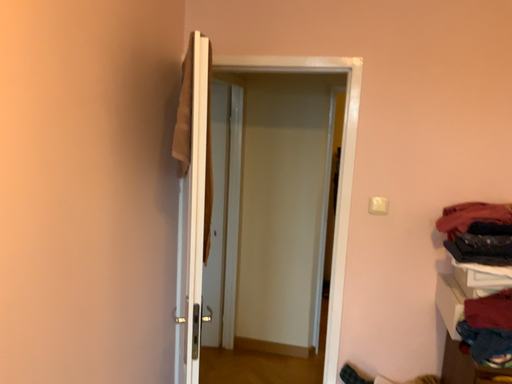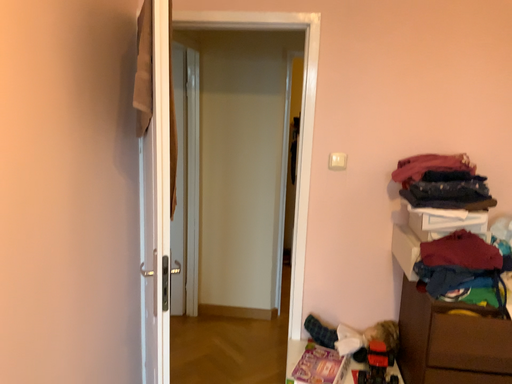
Question: Which way did the camera rotate in the video?

Choices:
 (A) rotated left
 (B) rotated right

Answer: (B)